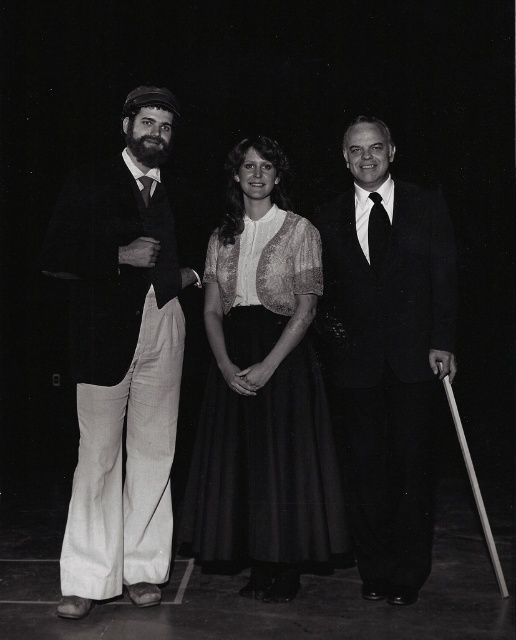
Does white cotton pants at left appear over smooth black suit at center?

Correct, white cotton pants at left is located above smooth black suit at center.

Measure the distance between point (141, 538) and camera.

The distance of point (141, 538) from camera is 3.45 meters.

Identify the location of white cotton pants at left. (121, 360).

Describe the element at coordinates (120, 356) in the screenshot. I see `matte black dress at center` at that location.

Which is more to the right, matte black dress at center or smooth black suit at center?

smooth black suit at center is more to the right.

Is point (76, 307) more distant than point (392, 268)?

No, it is not.

Identify the location of matte black dress at center. This screenshot has height=640, width=516. [120, 356].

In the scene shown: Does white cotton pants at left have a lesser width compared to matte black dress at center?

Yes.

Between white cotton pants at left and matte black dress at center, which one is positioned higher?

white cotton pants at left is higher up.

Identify the location of white cotton pants at left. This screenshot has width=516, height=640. (121, 360).